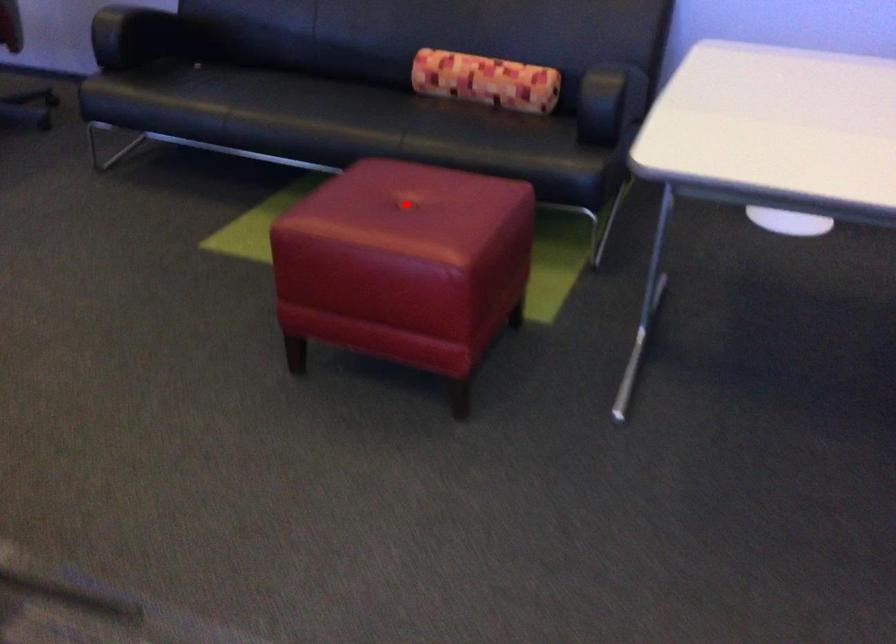
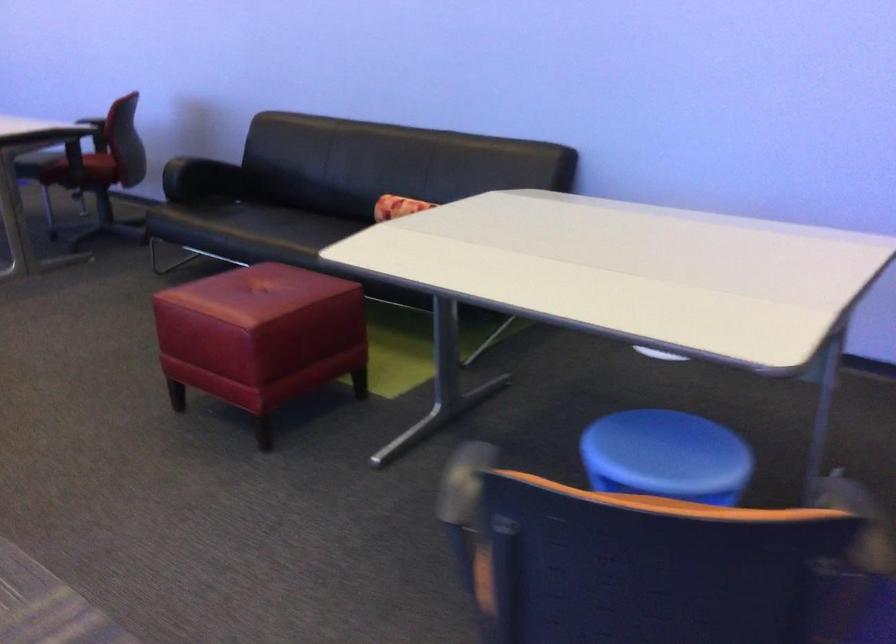
Question: A red point is marked in image1. In image2, is the corresponding 3D point closer to the camera or farther? Reply with the corresponding letter.

Choices:
 (A) The corresponding 3D point is closer.
 (B) The corresponding 3D point is farther.

Answer: (B)